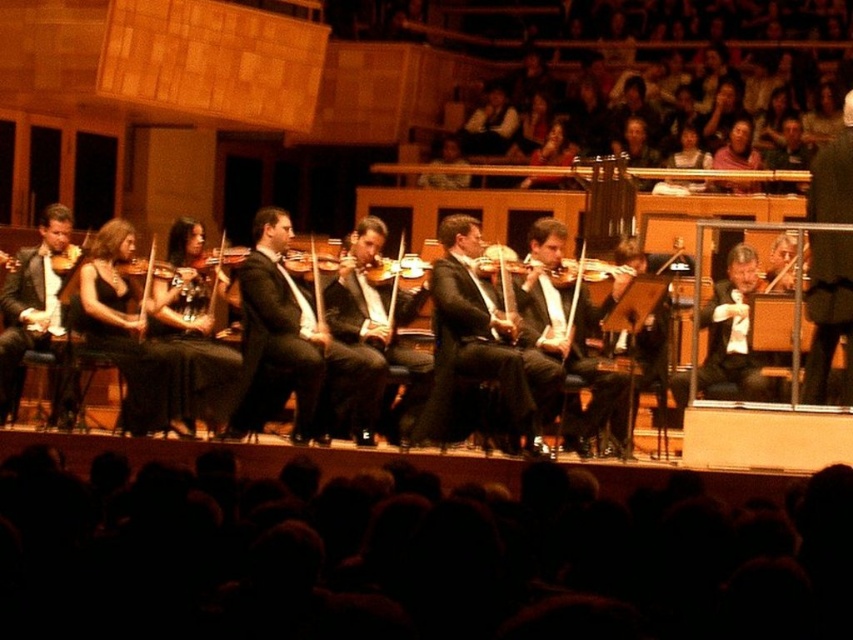
Question: Is black satin violin at center bigger than matte black violin at center?

Choices:
 (A) no
 (B) yes

Answer: (A)

Question: Which object is the farthest from the matte black violin at center?

Choices:
 (A) matte black violin at left
 (B) wooden violin at center
 (C) black satin suit at center
 (D) black satin violin at center

Answer: (A)

Question: Is black satin suit at center below matte black violin at left?

Choices:
 (A) yes
 (B) no

Answer: (B)

Question: Which object is closer to the camera taking this photo?

Choices:
 (A) black satin suit at center
 (B) black satin violin at center

Answer: (B)

Question: Which object is closer to the camera taking this photo?

Choices:
 (A) matte black violin at center
 (B) wooden violin at center
 (C) black satin violin at center
 (D) matte black violin at left

Answer: (C)

Question: From the image, what is the correct spatial relationship of black satin suit at center in relation to matte black violin at left?

Choices:
 (A) below
 (B) above

Answer: (B)